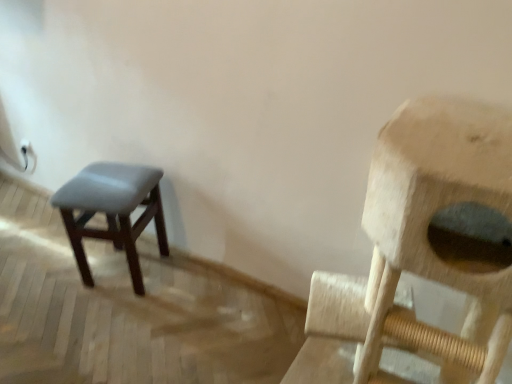
Image resolution: width=512 pixels, height=384 pixels. I want to click on matte gray stool at left, so click(x=112, y=211).

This screenshot has height=384, width=512. What do you see at coordinates (112, 211) in the screenshot?
I see `matte gray stool at left` at bounding box center [112, 211].

You are a GUI agent. You are given a task and a screenshot of the screen. Output one action in this format:
    pyautogui.click(x=<x>, y=<y>)
    Task: Click on the matte gray stool at left
    The image size is (512, 384).
    Given the screenshot: What is the action you would take?
    pyautogui.click(x=112, y=211)